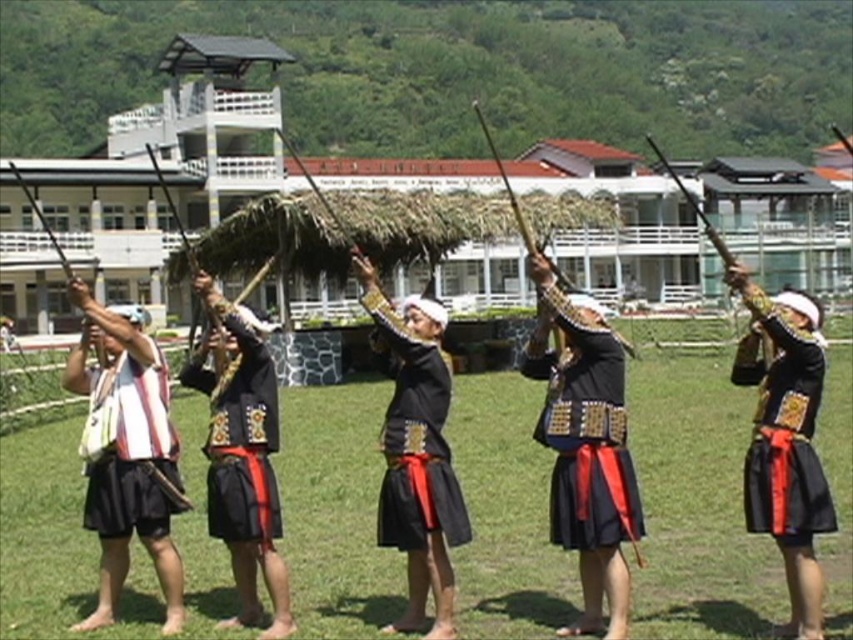
You are a photographer trying to capture the dance performance. You want to ensure that both the green grass at center and the black matte cloth at center are visible in your shot. Based on their positions, which object should you focus on first to frame the scene properly?

The green grass at center is positioned on the right side of black matte cloth at center, so you should focus on the black matte cloth at center first to ensure it is centered before adjusting the frame to include the green grass at center on its right side.

Consider the image. You are a photographer planning to capture the dance performance from the back of the modern buildings. You notice two elements at the center of the scene, the green grass at center and the black matte cloth at center. Which one will appear taller in the photo?

The green grass at center is taller than the black matte cloth at center, so it will appear taller in the photo.

You are a photographer positioned in front of the dancers. You notice a striped fabric bag at left and a black matte skirt at center. Which object is nearer to you?

The striped fabric bag at left is closer to the viewer than the black matte skirt at center.